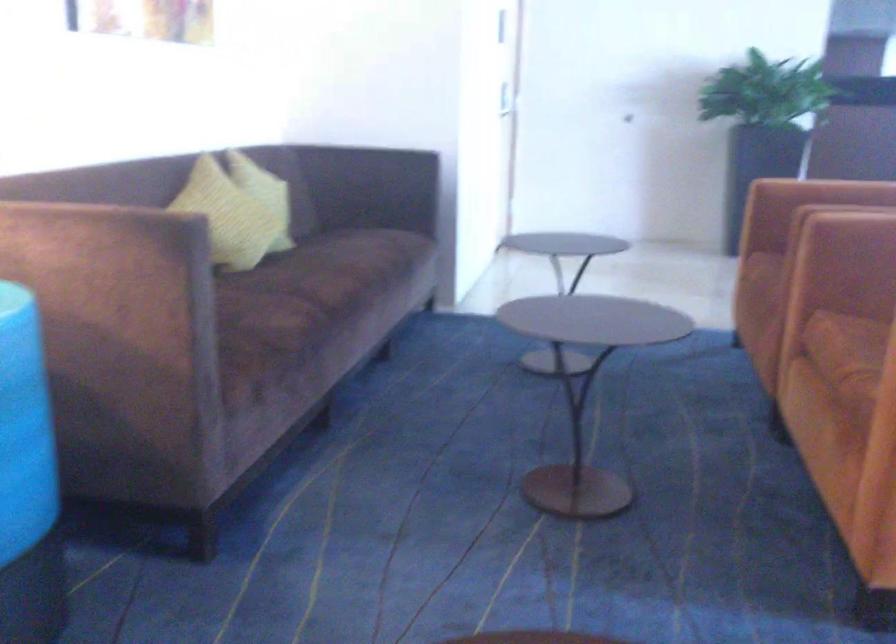
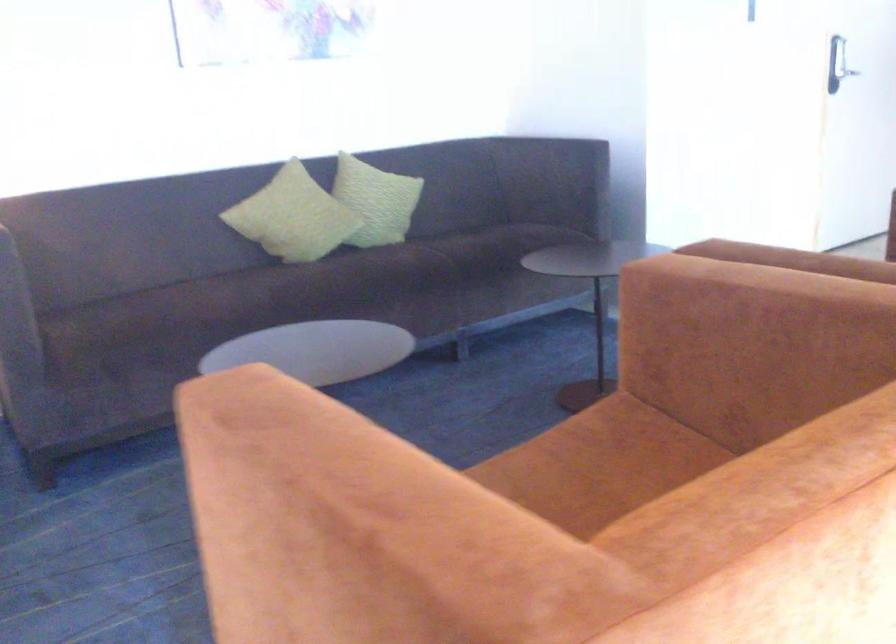
Locate, in the second image, the point that corresponds to pixel 316 290 in the first image.

(270, 290)